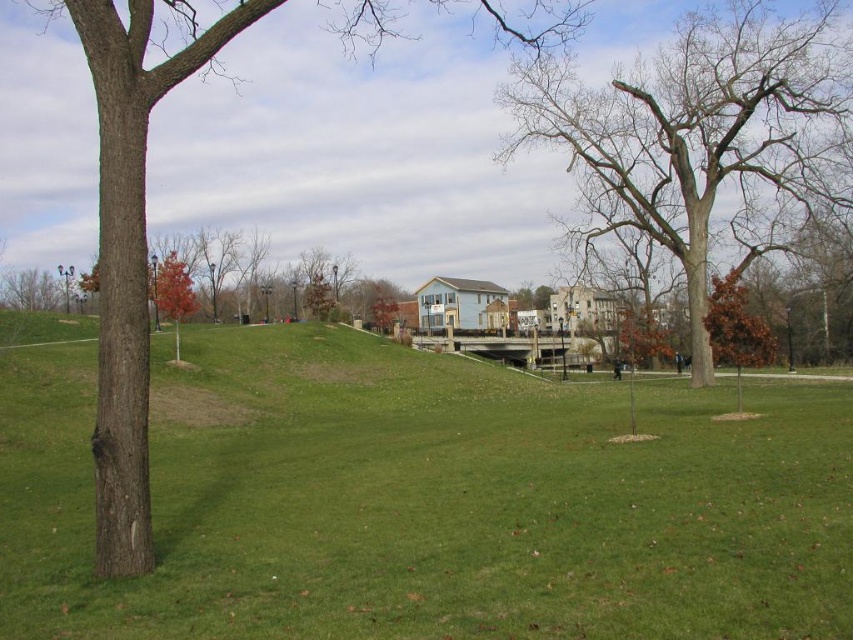
You are standing at the point marked as point (685, 131) in the image. What type of surface are you currently standing on?

The point (685, 131) is on a bare wood tree at center, so you are standing on a bare wood tree.

In the scene shown: You are standing in the park and see the green grassy at center and the brown rough bark tree at left. Which object is positioned to the right of the other?

The green grassy at center is to the right of the brown rough bark tree at left.

You are standing in the park and see the bare wood tree at center and the brown rough bark tree at left. Which tree is closer to the left edge of the image?

The brown rough bark tree at left is closer to the left edge of the image because it is positioned to the left of the bare wood tree at center.